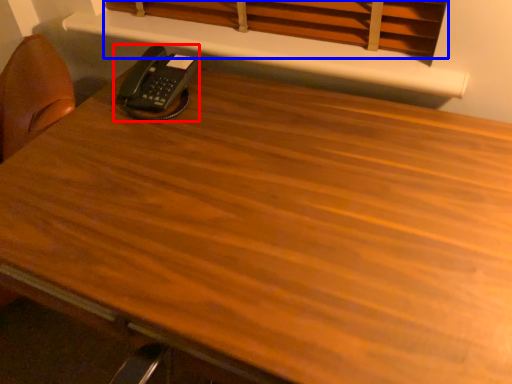
Question: Which object is further to the camera taking this photo, corded phone (highlighted by a red box) or curtain (highlighted by a blue box)?

Choices:
 (A) corded phone
 (B) curtain

Answer: (A)